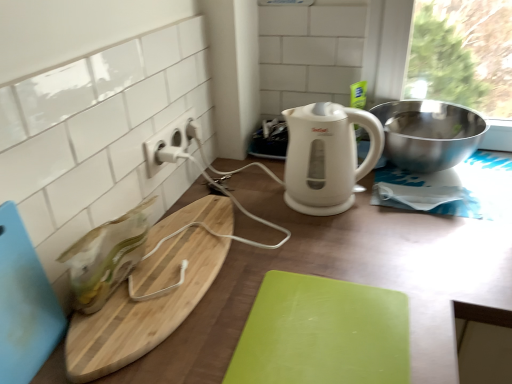
The image size is (512, 384). I want to click on free point above natural wood cutting board at left, the second cutting board when ordered from right to left (from a real-world perspective), so click(x=170, y=257).